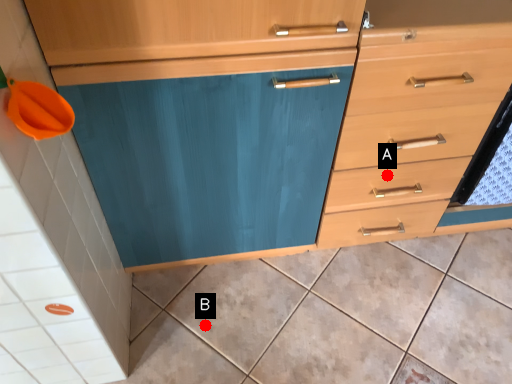
Question: Two points are circled on the image, labeled by A and B beside each circle. Which point is closer to the camera?

Choices:
 (A) A is closer
 (B) B is closer

Answer: (A)